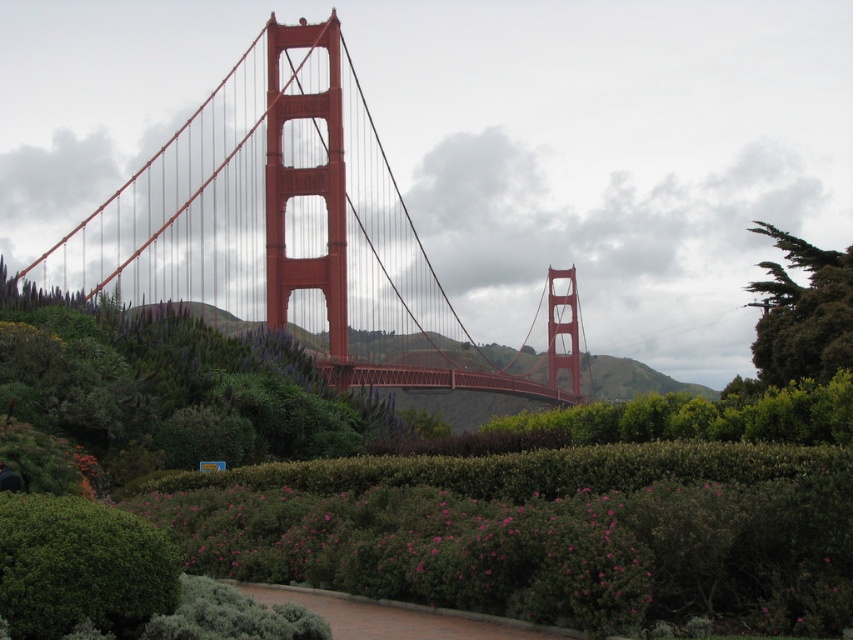
Question: Can you confirm if glossy steel suspension bridge at center is wider than green leafy bush at lower left?

Choices:
 (A) yes
 (B) no

Answer: (A)

Question: Estimate the real-world distances between objects in this image. Which object is closer to the green leafy bush at lower left?

Choices:
 (A) green textured tree at upper right
 (B) glossy steel suspension bridge at center

Answer: (A)

Question: Is green leafy bush at lower left thinner than green textured tree at upper right?

Choices:
 (A) yes
 (B) no

Answer: (A)

Question: Which of the following is the farthest from the observer?

Choices:
 (A) (125, 625)
 (B) (340, 56)
 (C) (757, 356)

Answer: (B)

Question: Can you confirm if glossy steel suspension bridge at center is thinner than green textured tree at upper right?

Choices:
 (A) no
 (B) yes

Answer: (A)

Question: Which point is farther to the camera?

Choices:
 (A) green textured tree at upper right
 (B) glossy steel suspension bridge at center

Answer: (B)